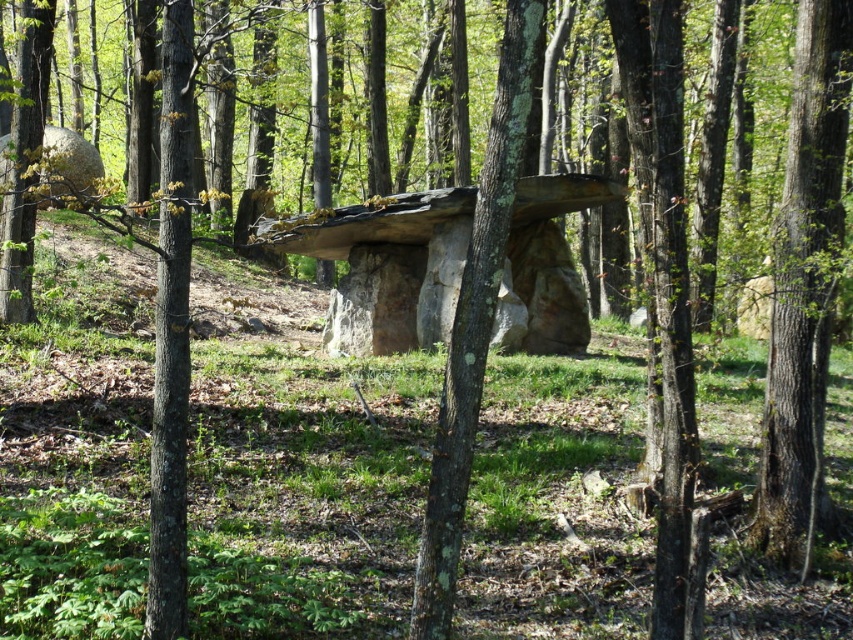
Question: Which of the following is the closest to the observer?

Choices:
 (A) smooth bark tree at center
 (B) lichen-covered tree trunk at center

Answer: (B)

Question: Which of the following is the farthest from the observer?

Choices:
 (A) smooth bark tree at center
 (B) lichen-covered tree trunk at center

Answer: (A)

Question: Can you confirm if smooth bark tree at center is positioned above lichen-covered tree trunk at center?

Choices:
 (A) no
 (B) yes

Answer: (B)

Question: Is smooth bark tree at center above lichen-covered tree trunk at center?

Choices:
 (A) no
 (B) yes

Answer: (B)

Question: Which object appears closest to the camera in this image?

Choices:
 (A) smooth bark tree at center
 (B) lichen-covered tree trunk at center

Answer: (B)

Question: Is smooth bark tree at center thinner than lichen-covered tree trunk at center?

Choices:
 (A) no
 (B) yes

Answer: (A)